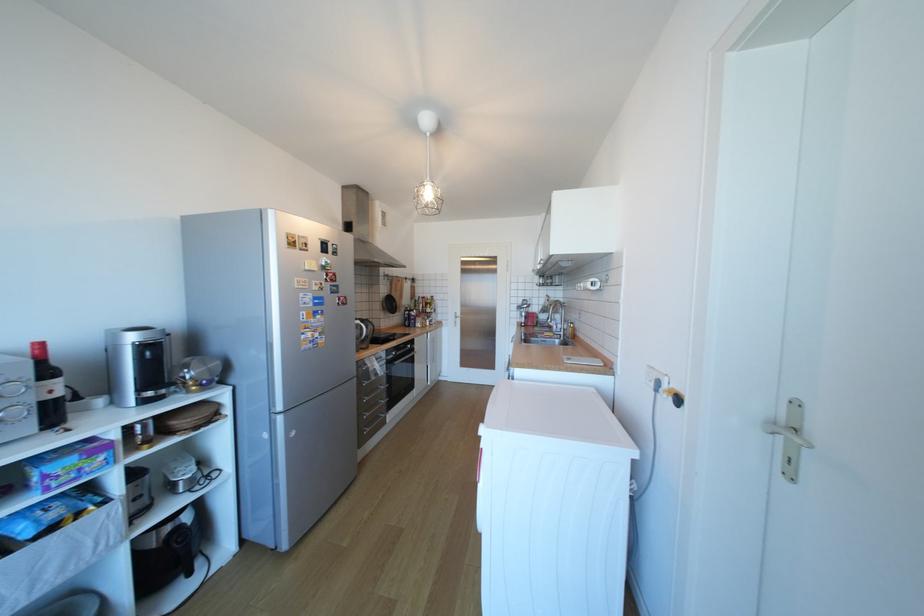
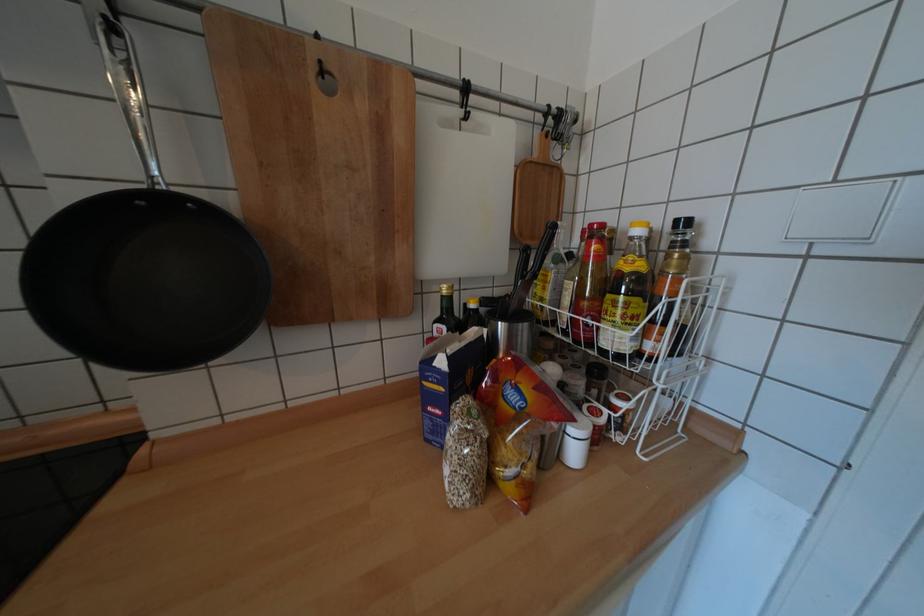
Where in the second image is the point corresponding to (x=441, y=296) from the first image?

(694, 224)